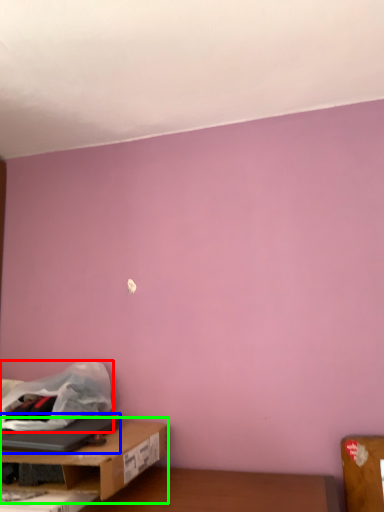
Question: Which object is positioned farthest from plastic bag (highlighted by a red box)? Select from laptop (highlighted by a blue box) and table (highlighted by a green box).

Choices:
 (A) laptop
 (B) table

Answer: (B)